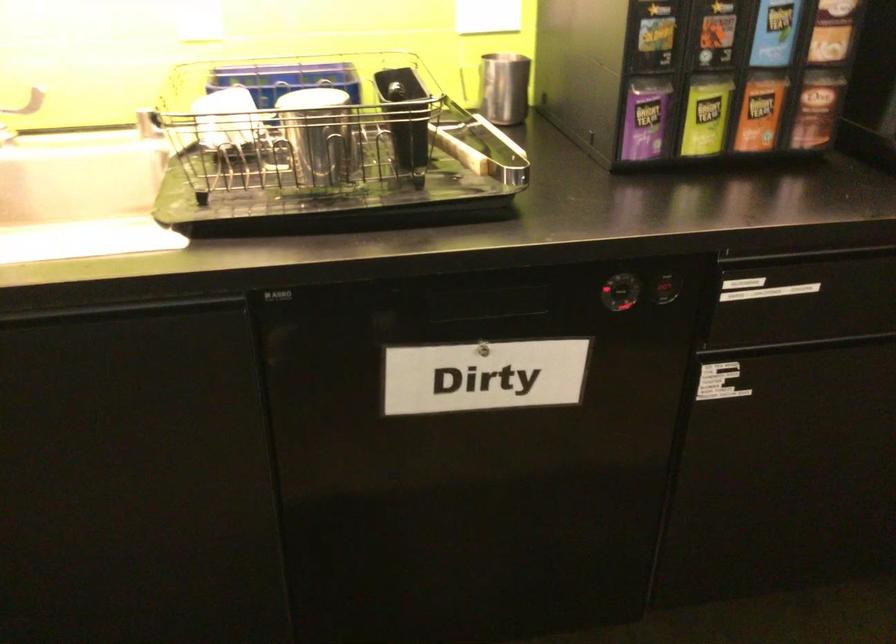
Find where to lift the black cutlery holder. Please return your answer as a coordinate pair (x, y).

(339, 187)